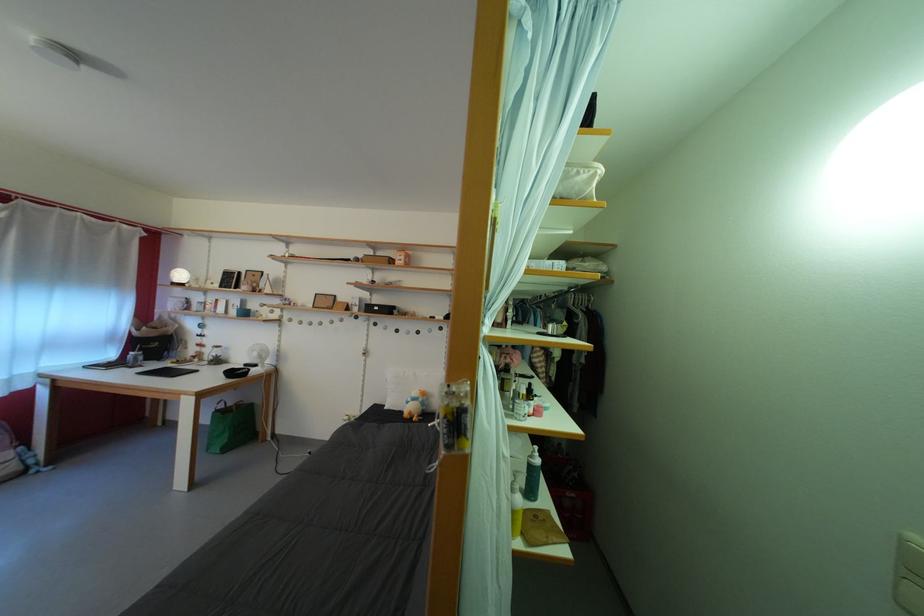
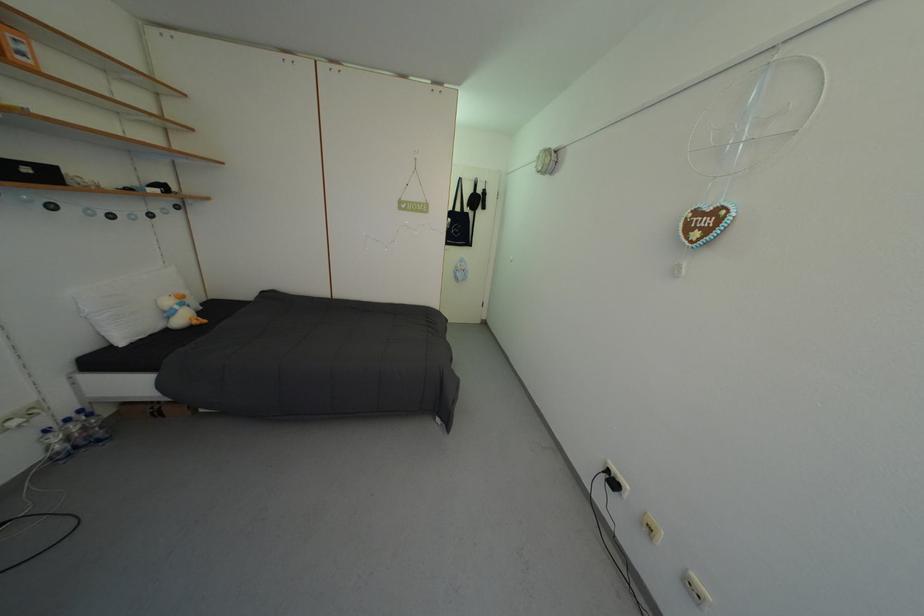
In the second image, find the point that corresponds to [432,400] in the first image.

(190, 302)